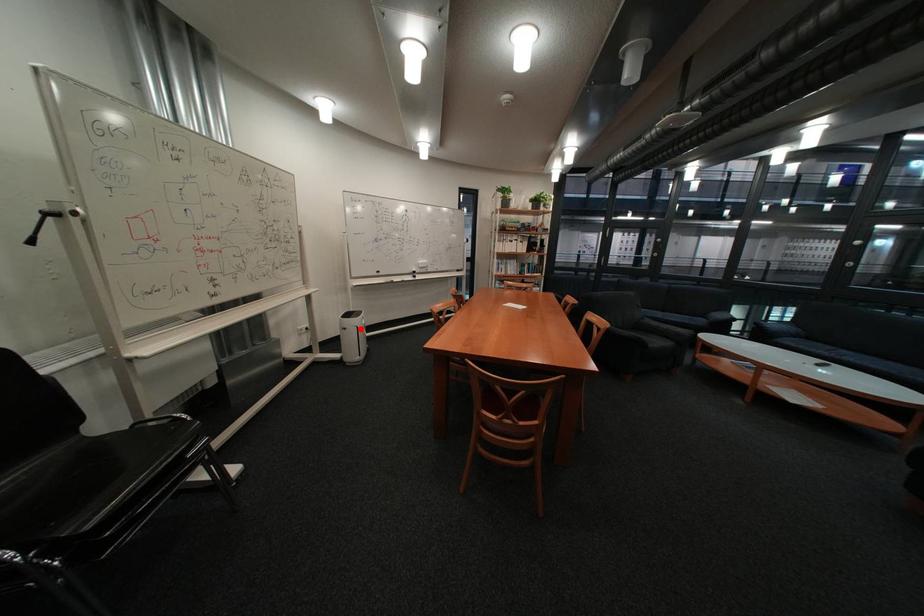
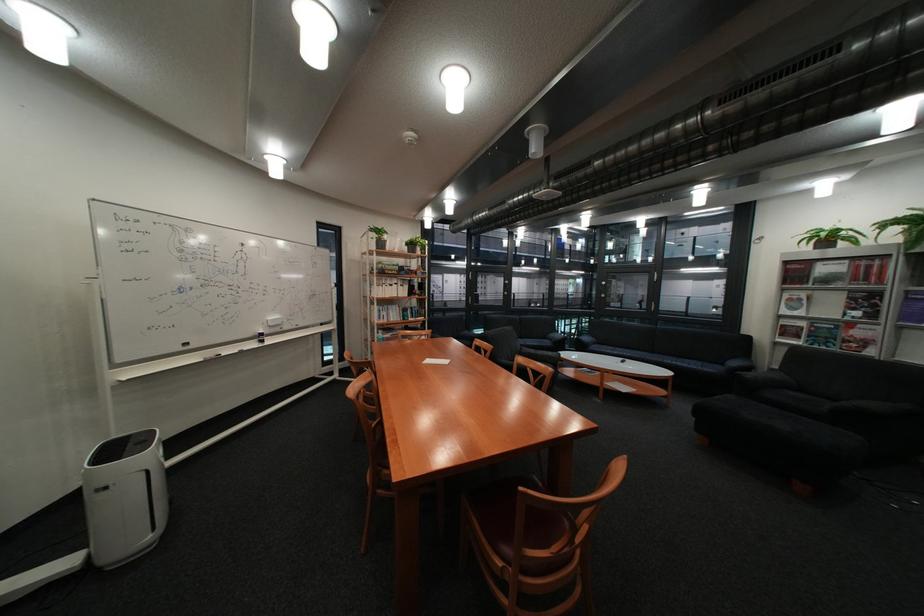
Locate, in the second image, the point that corresponds to the highlighted location in the first image.

(120, 488)